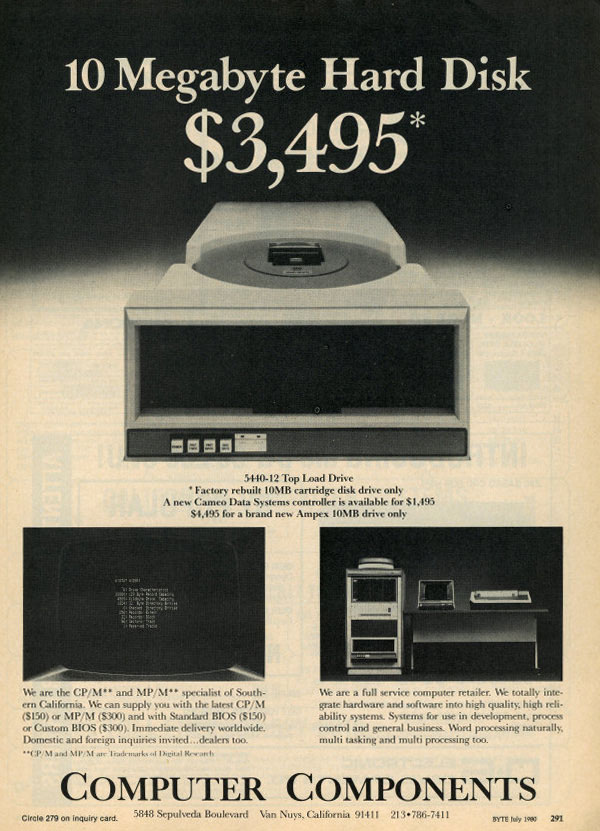
Identify the location of computer shelving. (393, 576).